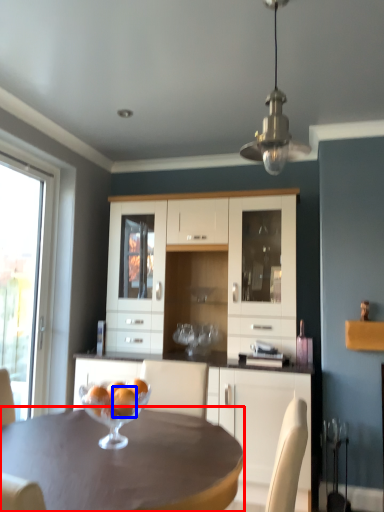
Question: Which of the following is the farthest to the observer, desk (highlighted by a red box) or orange (highlighted by a blue box)?

Choices:
 (A) desk
 (B) orange

Answer: (B)